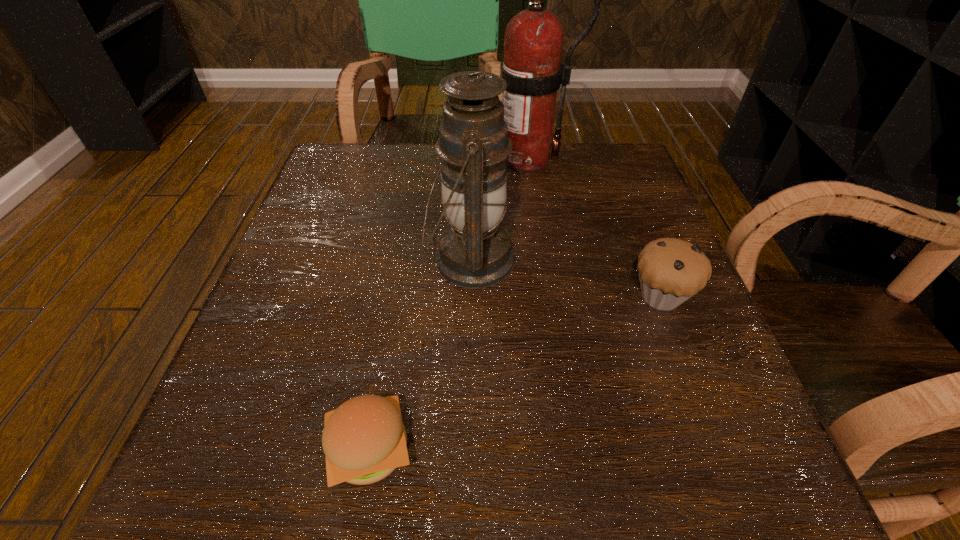
Locate an element on the screen. The height and width of the screenshot is (540, 960). vacant area between the farthest object and the rightmost object is located at coordinates (593, 227).

Find the location of a particular element. vacant area between the muffin and the hamburger is located at coordinates (516, 373).

Where is `vacant space that is in between the farthest object and the rightmost object`? The width and height of the screenshot is (960, 540). vacant space that is in between the farthest object and the rightmost object is located at coordinates (593, 227).

Locate an element on the screen. the second closest object to the hamburger is located at coordinates (671, 270).

Choose which object is the nearest neighbor to the farthest object. Please provide its 2D coordinates. Your answer should be formatted as a tuple, i.e. [(x, y)], where the tuple contains the x and y coordinates of a point satisfying the conditions above.

[(474, 252)]

At what (x,y) coordinates should I click in order to perform the action: click on vacant region that satisfies the following two spatial constraints: 1. at the nozzle of the farthest object; 2. on the front side of the shortest object. Please return your answer as a coordinate pair (x, y). Looking at the image, I should click on (564, 449).

Locate an element on the screen. The height and width of the screenshot is (540, 960). free location that satisfies the following two spatial constraints: 1. at the nozzle of the farthest object; 2. on the back side of the second shortest object is located at coordinates 544,296.

Locate an element on the screen. vacant space that satisfies the following two spatial constraints: 1. on the back side of the third shortest object; 2. on the left side of the hamburger is located at coordinates (403, 260).

Find the location of a particular element. This screenshot has height=540, width=960. blank area in the image that satisfies the following two spatial constraints: 1. on the back side of the oil lamp; 2. on the left side of the nearest object is located at coordinates (403, 260).

At what (x,y) coordinates should I click in order to perform the action: click on free space that satisfies the following two spatial constraints: 1. at the nozzle of the second shortest object; 2. on the right side of the farthest object. Please return your answer as a coordinate pair (x, y). The width and height of the screenshot is (960, 540). Looking at the image, I should click on (544, 296).